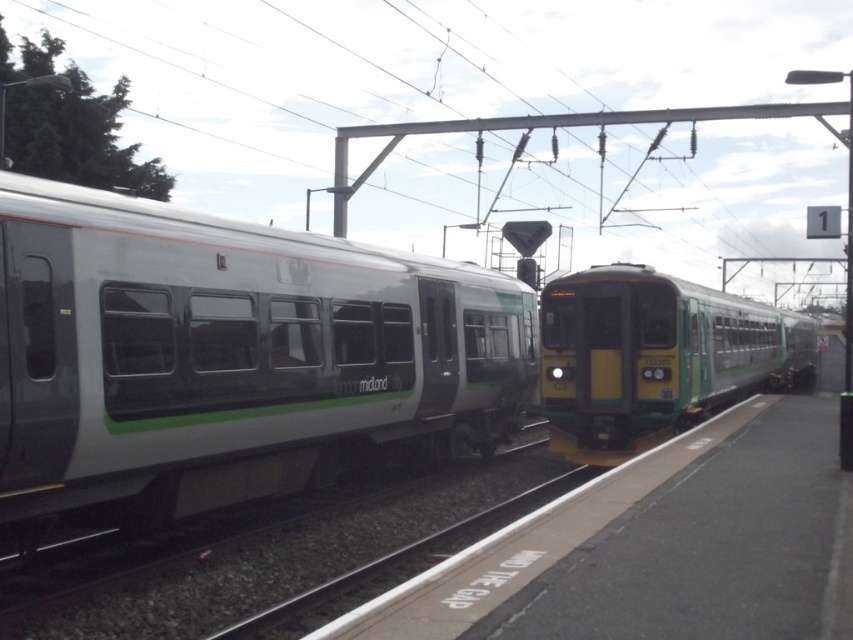
Question: Is silver/grey metallic train at left further to camera compared to green/yellow plastic train at center?

Choices:
 (A) no
 (B) yes

Answer: (A)

Question: Which object is closer to the camera taking this photo?

Choices:
 (A) silver/grey metallic train at left
 (B) green/yellow plastic train at center

Answer: (A)

Question: Which point is farther from the camera taking this photo?

Choices:
 (A) (225, 305)
 (B) (706, 396)

Answer: (B)

Question: Can you confirm if silver/grey metallic train at left is positioned to the left of green/yellow plastic train at center?

Choices:
 (A) yes
 (B) no

Answer: (A)

Question: Does silver/grey metallic train at left appear on the left side of green/yellow plastic train at center?

Choices:
 (A) no
 (B) yes

Answer: (B)

Question: Which object appears farthest from the camera in this image?

Choices:
 (A) silver/grey metallic train at left
 (B) green/yellow plastic train at center

Answer: (B)